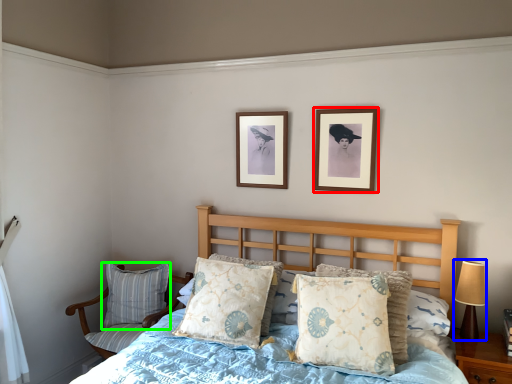
Question: Which object is positioned closest to picture frame (highlighted by a red box)? Select from table lamp (highlighted by a blue box) and pillow (highlighted by a green box).

Choices:
 (A) table lamp
 (B) pillow

Answer: (A)